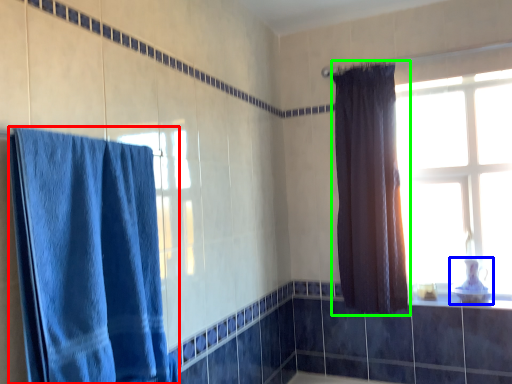
Question: Which is farther away from curtain (highlighted by a red box)? sink (highlighted by a blue box) or curtain (highlighted by a green box)?

Choices:
 (A) sink
 (B) curtain

Answer: (A)